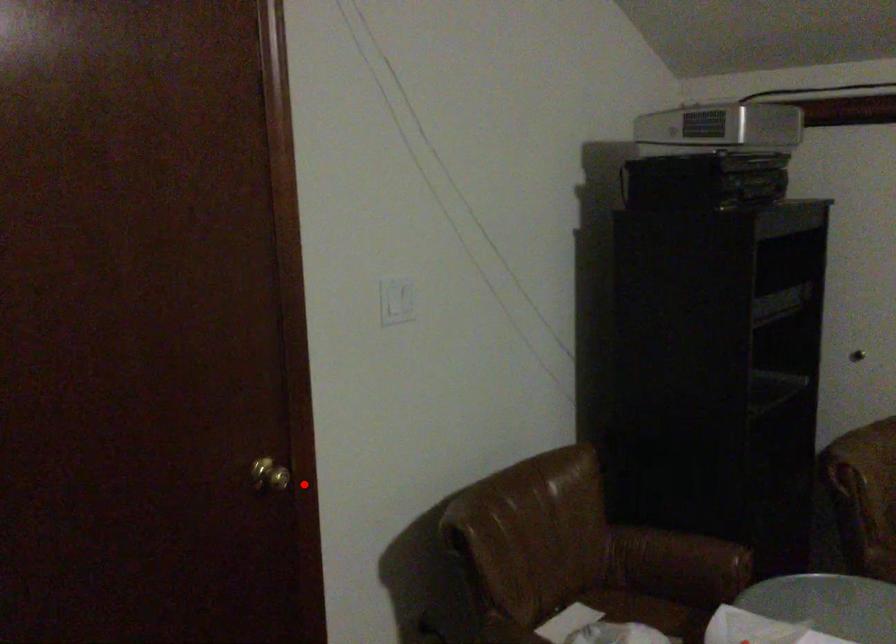
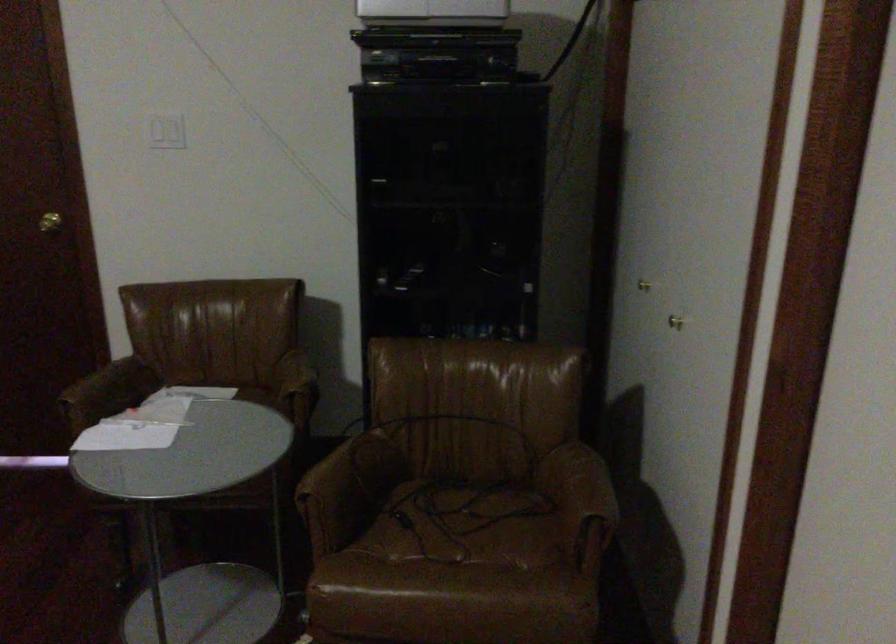
Question: A red point is marked in image1. In image2, is the corresponding 3D point closer to the camera or farther? Reply with the corresponding letter.

Choices:
 (A) The corresponding 3D point is closer.
 (B) The corresponding 3D point is farther.

Answer: (B)